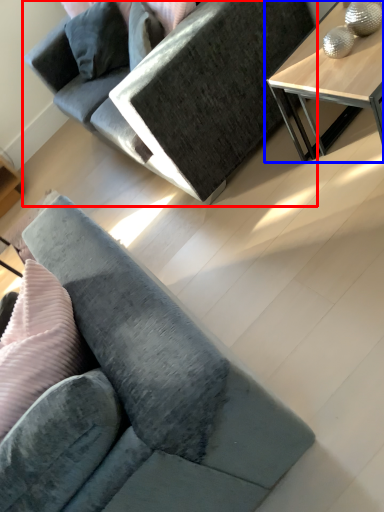
Question: Which object appears closest to the camera in this image, studio couch (highlighted by a red box) or table (highlighted by a blue box)?

Choices:
 (A) studio couch
 (B) table

Answer: (B)